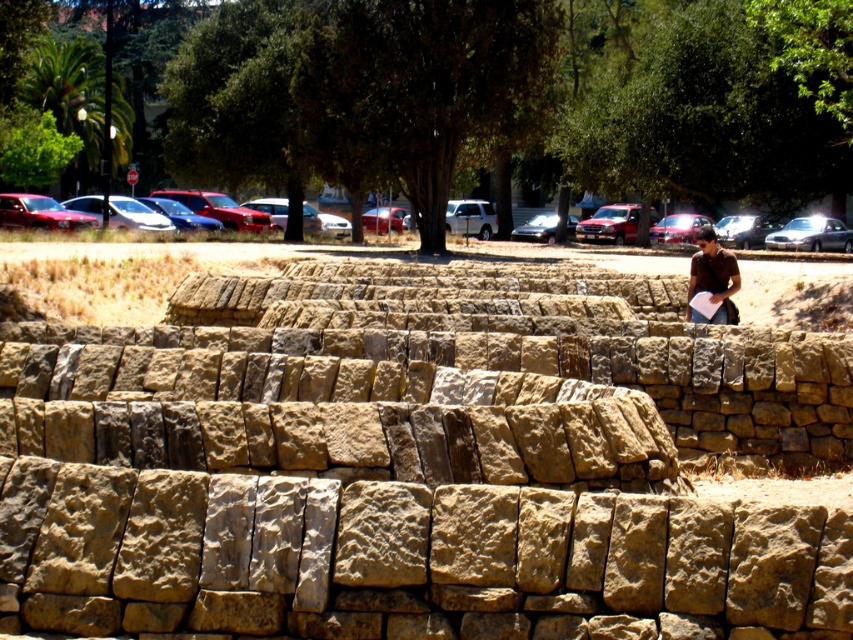
You are standing in front of the natural stone wall at center and the brown shirt at upper right. Which object is located to the right side of the other?

The brown shirt at upper right is located to the right of the natural stone wall at center because the natural stone wall at center is positioned on the left side of brown shirt at upper right.

You are standing in front of the natural stone wall at center. If you want to take a photo of it with your smartphone, which has a minimum focus distance of 1.5 feet, will you be able to capture the wall clearly?

The natural stone wall at center is 19.87 feet from camera, which is well beyond the smartphone camera minimum focus distance of 1.5 feet. Yes, you can capture the wall clearly.